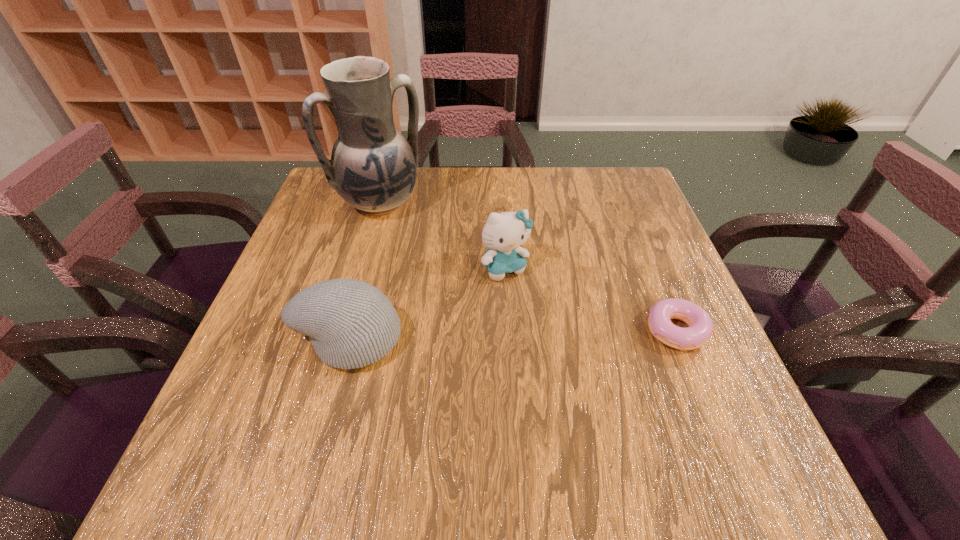
The height and width of the screenshot is (540, 960). Find the location of `vacant space on the desktop that is between the beanie and the rightmost object and is positioned on the front-facing side of the farthest object`. vacant space on the desktop that is between the beanie and the rightmost object and is positioned on the front-facing side of the farthest object is located at coordinates (481, 335).

Where is `free spot on the desktop that is between the beanie and the doughnut and is positioned on the face of the second farthest object`? This screenshot has width=960, height=540. free spot on the desktop that is between the beanie and the doughnut and is positioned on the face of the second farthest object is located at coordinates (544, 333).